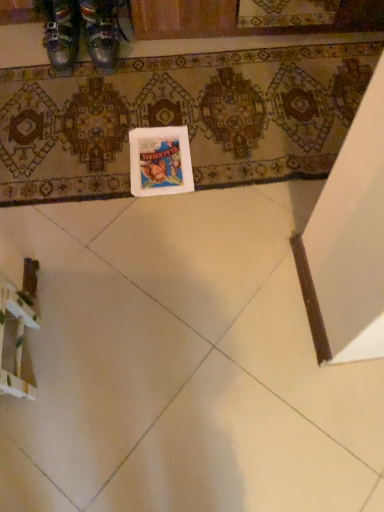
Locate an element on the screen. vacant space positioned to the left of metallic leather shoes at upper left, which is counted as the first footwear, starting from the left is located at coordinates (21, 50).